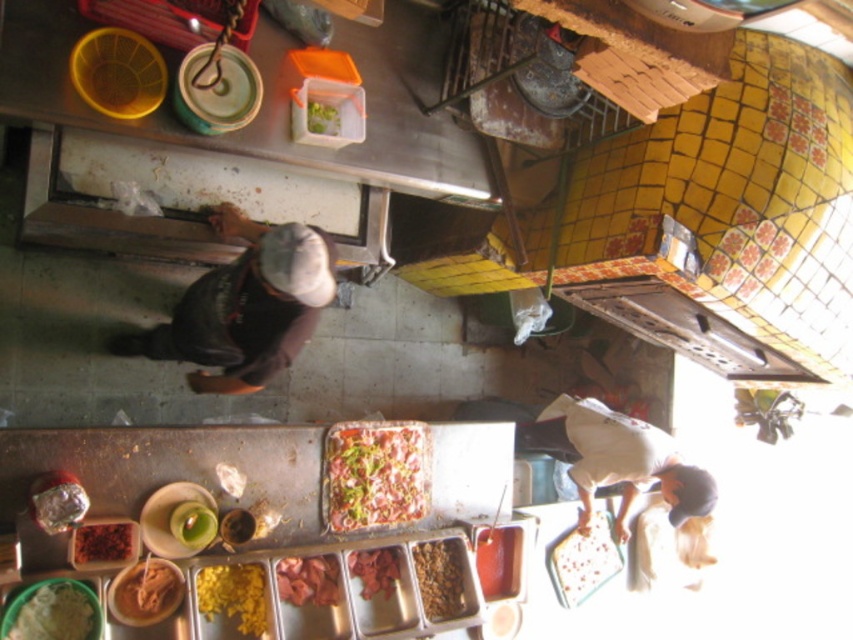
Question: Which point is farther from the camera taking this photo?

Choices:
 (A) (100, 541)
 (B) (380, 561)

Answer: (B)

Question: Does green matte rice at lower left appear on the right side of green leafy vegetable at center?

Choices:
 (A) no
 (B) yes

Answer: (A)

Question: Does dark brown fabric at center appear under brown crumbly meat at center?

Choices:
 (A) no
 (B) yes

Answer: (A)

Question: Can you confirm if dark brown fabric at center is wider than raw meat at center?

Choices:
 (A) no
 (B) yes

Answer: (B)

Question: Among these objects, which one is nearest to the camera?

Choices:
 (A) spotted white plate at lower right
 (B) shiny brown meat at center
 (C) brown crumbly meat at center
 (D) brown crumbly at lower left

Answer: (D)

Question: Among these objects, which one is farthest from the camera?

Choices:
 (A) brown crumbly meat at center
 (B) spotted white plate at lower right
 (C) brown crumbly at lower left
 (D) shiny red meat at center

Answer: (B)